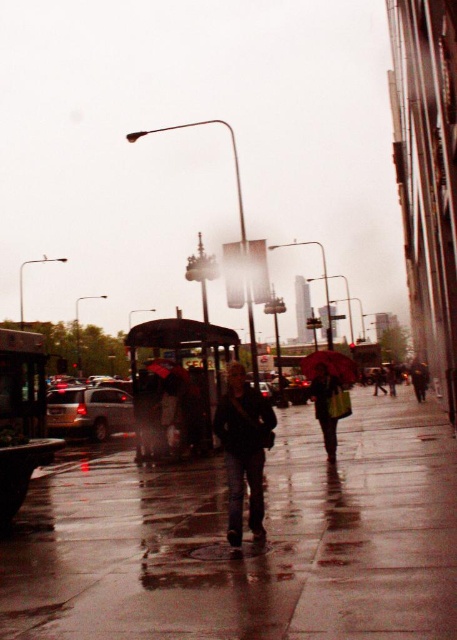
You are a pedestrian trying to avoid getting wet in the rain. You see a dark blue leather jacket at center and a raincoat fabric umbrella at center. Which item is closer to you?

The dark blue leather jacket at center is positioned over the raincoat fabric umbrella at center, so the dark blue leather jacket at center is closer to you.

You are standing on the sidewalk in the rainy urban scene. You see two points marked in the image. Which point is nearer to you, point at coordinate [53,404] or point at coordinate [375,394]?

Point at coordinate [53,404] is closer to the viewer than point at coordinate [375,394].